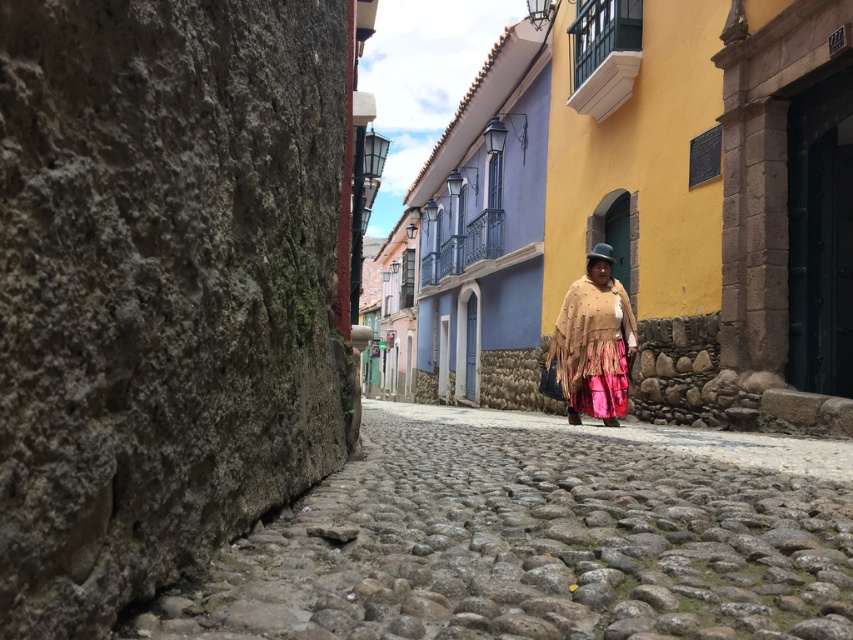
You are a tourist standing on the gray cobblestone path at center and want to pick up the beige fringed poncho at center. Can you reach it without moving your feet?

The gray cobblestone path at center and beige fringed poncho at center are 29.11 inches apart, so yes, you can reach the beige fringed poncho at center without moving your feet since the distance is within typical arm reach.

You are a street performer planning to set up a small stage on the cobblestone street at center. You have a beige fringed poncho at center that you want to display on a stand. Since both are at the center, which one should you place first to ensure they don

The cobblestone street at center is wider than the beige fringed poncho at center, so you should place the smaller beige fringed poncho at center first to ensure there is enough space for the wider cobblestone street at center.